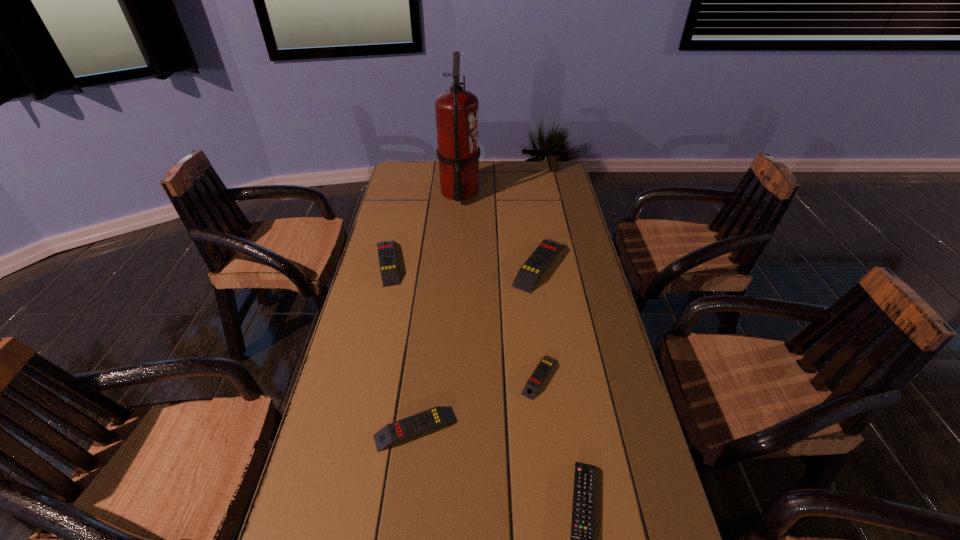
This screenshot has height=540, width=960. I want to click on vacant point that satisfies the following two spatial constraints: 1. toward the nozzle of the tallest remote control; 2. on the right side of the sixth nearest object, so click(x=455, y=265).